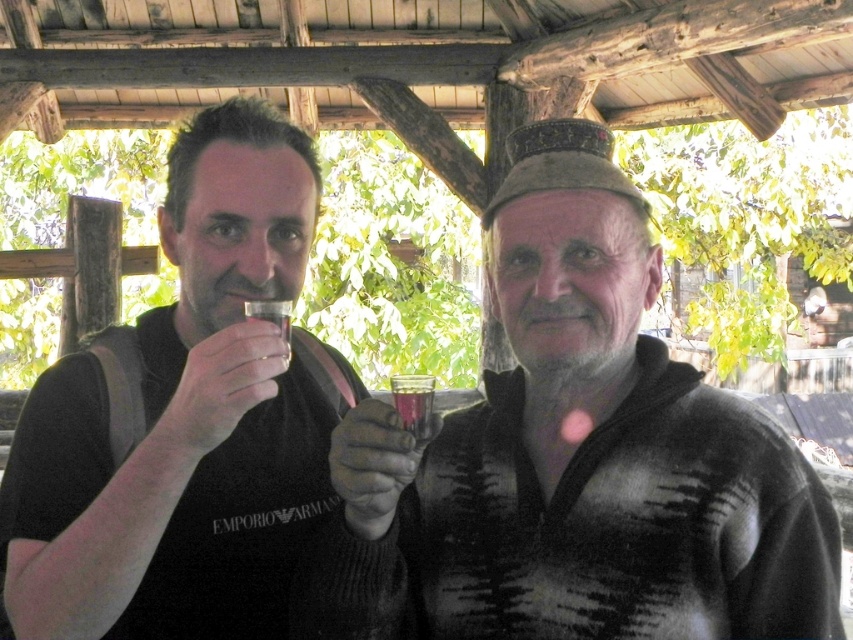
Which of these two, matte brown hat at center or pink translucent glass at center, stands taller?

matte brown hat at center

Does matte brown hat at center lie behind pink translucent glass at center?

Yes.

Where is `matte brown hat at center`? This screenshot has height=640, width=853. matte brown hat at center is located at coordinates (581, 454).

Is point (334, 483) in front of point (260, 312)?

No, it is behind (260, 312).

Between pink translucent glass at center and clear glass at center, which one appears on the left side from the viewer's perspective?

Positioned to the left is clear glass at center.

Who is more distant from viewer, (x=378, y=499) or (x=283, y=333)?

The point (x=283, y=333) is behind.

You are a GUI agent. You are given a task and a screenshot of the screen. Output one action in this format:
    pyautogui.click(x=<x>, y=<y>)
    Task: Click on the pink translucent glass at center
    This screenshot has width=853, height=640.
    Given the screenshot: What is the action you would take?
    pyautogui.click(x=373, y=465)

Can you confirm if matte brown hat at center is positioned below matte black hand at left?

Correct, matte brown hat at center is located below matte black hand at left.

Based on the photo, between matte brown hat at center and matte black hand at left, which one is positioned lower?

matte brown hat at center is below.

Does point (735, 577) come closer to viewer compared to point (183, 397)?

No, it is not.

The height and width of the screenshot is (640, 853). I want to click on matte brown hat at center, so click(581, 454).